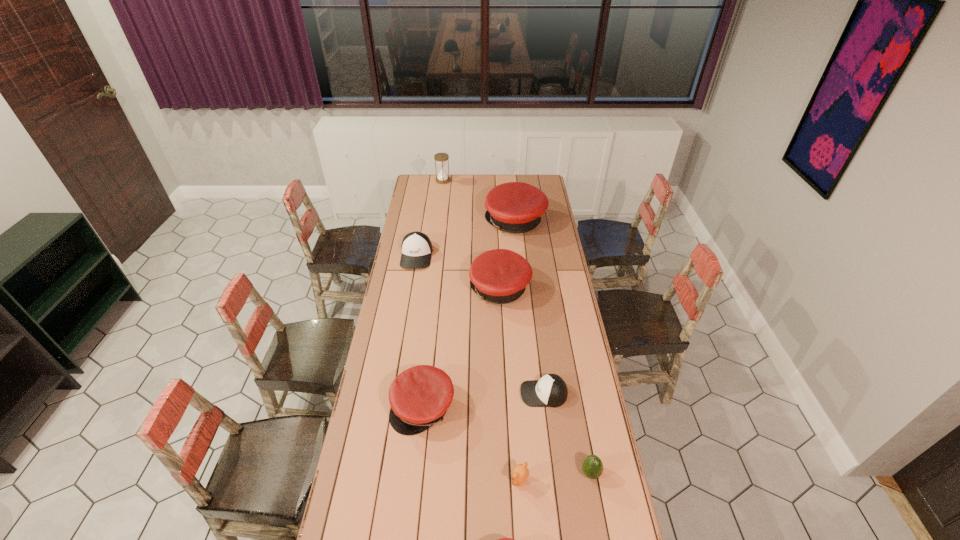
Image resolution: width=960 pixels, height=540 pixels. I want to click on free location located 0.350m at the front of the third smallest red cap where the visor is located, so click(396, 289).

Locate an element on the screen. This screenshot has height=540, width=960. vacant space located on the front panel of the left gray cap is located at coordinates (410, 294).

Image resolution: width=960 pixels, height=540 pixels. What are the coordinates of `vacant space situated at the front of the leftmost red cap where the visor is located` in the screenshot? It's located at (411, 518).

Locate an element on the screen. This screenshot has height=540, width=960. vacant space located 0.050m on the face of the teddy bear is located at coordinates (495, 481).

In order to click on vacant space positioned 0.260m on the face of the teddy bear in this screenshot , I will do `click(432, 481)`.

Find the location of a particular element. free space located 0.370m on the face of the teddy bear is located at coordinates (398, 481).

Find the location of a particular element. vacant region located 0.290m on the left of the green avocado is located at coordinates (493, 474).

Locate an element on the screen. Image resolution: width=960 pixels, height=540 pixels. vacant space situated on the front panel of the smaller gray cap is located at coordinates (437, 394).

Where is `vacant space situated 0.360m on the front panel of the smaller gray cap`? The height and width of the screenshot is (540, 960). vacant space situated 0.360m on the front panel of the smaller gray cap is located at coordinates (426, 394).

Where is `free location located 0.090m on the front panel of the smaller gray cap`? The width and height of the screenshot is (960, 540). free location located 0.090m on the front panel of the smaller gray cap is located at coordinates (497, 394).